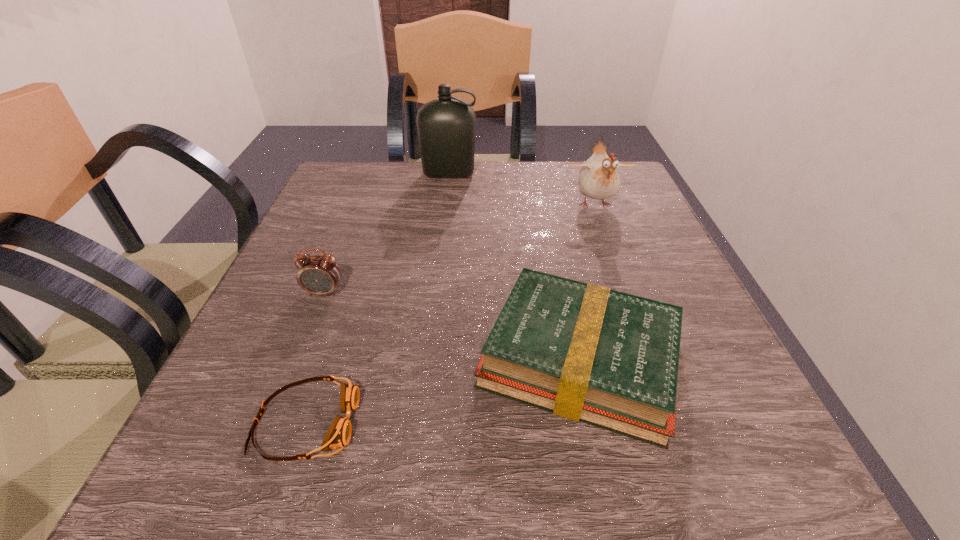
Locate an element on the screen. This screenshot has height=540, width=960. vacant region located 0.080m on the left of the hardback book is located at coordinates (421, 360).

Find the location of a particular element. The width and height of the screenshot is (960, 540). vacant space located 0.250m with the lenses facing forward on the goggles is located at coordinates (541, 423).

You are a GUI agent. You are given a task and a screenshot of the screen. Output one action in this format:
    pyautogui.click(x=<x>, y=<y>)
    Task: Click on the bottle present at the far edge
    The image size is (960, 540).
    Given the screenshot: What is the action you would take?
    pyautogui.click(x=446, y=126)

This screenshot has height=540, width=960. I want to click on bird that is at the far edge, so click(x=599, y=179).

Image resolution: width=960 pixels, height=540 pixels. I want to click on hardback book located at the near edge, so click(x=585, y=352).

This screenshot has height=540, width=960. What are the coordinates of `goggles at the near edge` in the screenshot? It's located at (338, 435).

At what (x,y) coordinates should I click in order to perform the action: click on alarm clock that is at the left edge. Please return your answer as a coordinate pair (x, y). Looking at the image, I should click on (319, 275).

Locate an element on the screen. This screenshot has width=960, height=540. goggles at the left edge is located at coordinates (338, 435).

This screenshot has width=960, height=540. Find the location of `bird located at the right edge`. bird located at the right edge is located at coordinates [x=599, y=179].

I want to click on hardback book at the right edge, so [x=585, y=352].